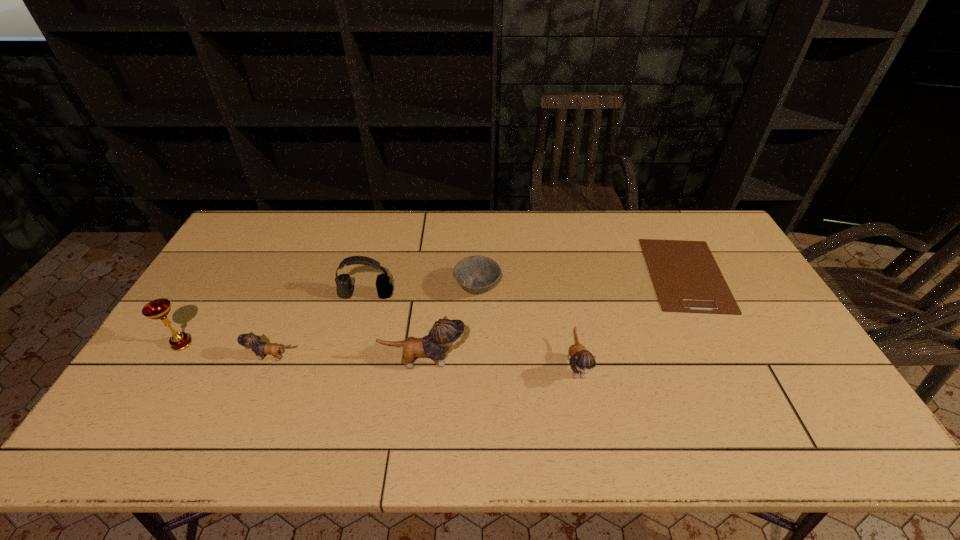
Image resolution: width=960 pixels, height=540 pixels. Find the location of `vacant position located on the front-facing side of the second object from left to right`. vacant position located on the front-facing side of the second object from left to right is located at coordinates (178, 357).

Locate an element on the screen. vacant space located 0.110m on the front-facing side of the second object from left to right is located at coordinates (207, 357).

Find the location of `free space located 0.060m on the front-facing side of the second object from left to right`. free space located 0.060m on the front-facing side of the second object from left to right is located at coordinates (227, 357).

Identify the location of blank space located 0.080m on the front-facing side of the tallest kitten. The width and height of the screenshot is (960, 540). (495, 361).

Identify the location of free space located 0.270m on the front of the clipboard. (747, 396).

You are a GUI agent. You are given a task and a screenshot of the screen. Output one action in this format:
    pyautogui.click(x=<x>, y=<y>)
    Task: Click on the blank space located on the headband of the headset
    
    Given the screenshot: What is the action you would take?
    pyautogui.click(x=347, y=368)

Locate an element on the screen. The width and height of the screenshot is (960, 540). free region located 0.340m on the right of the chalice is located at coordinates (317, 344).

This screenshot has height=540, width=960. Find the location of `free space located 0.240m on the left of the second shortest object`. free space located 0.240m on the left of the second shortest object is located at coordinates (377, 288).

Locate an element on the screen. object located at the far edge is located at coordinates (687, 279).

Identify the location of object positioned at the near edge. This screenshot has width=960, height=540. (582, 361).